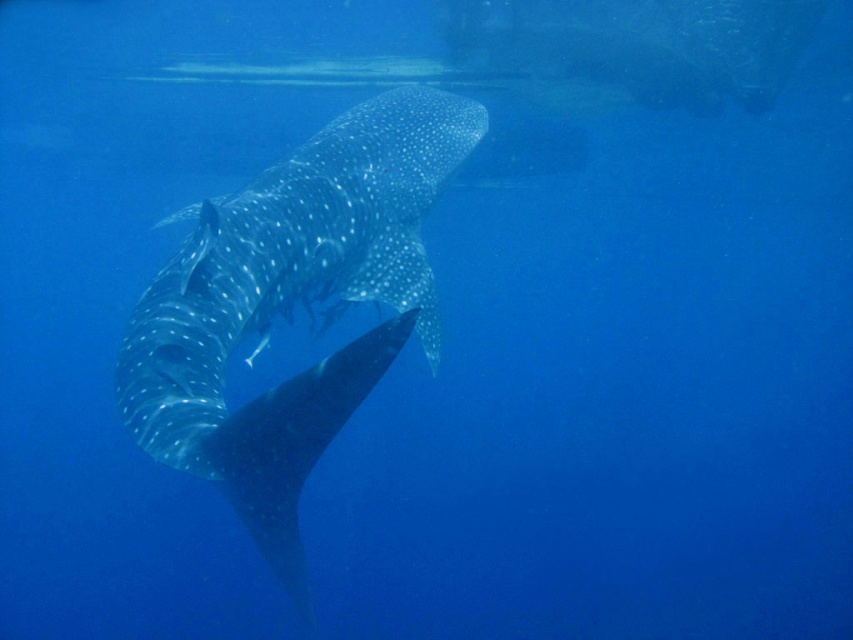
Question: Does speckled skin whale at center lie in front of speckled skin stingray at center?

Choices:
 (A) no
 (B) yes

Answer: (A)

Question: Among these points, which one is nearest to the camera?

Choices:
 (A) (421, 202)
 (B) (346, 349)

Answer: (B)

Question: Which point is farther to the camera?

Choices:
 (A) pos(265,442)
 (B) pos(280,515)

Answer: (B)

Question: Does speckled skin whale at center appear over speckled skin stingray at center?

Choices:
 (A) yes
 (B) no

Answer: (A)

Question: Is speckled skin whale at center thinner than speckled skin stingray at center?

Choices:
 (A) yes
 (B) no

Answer: (B)